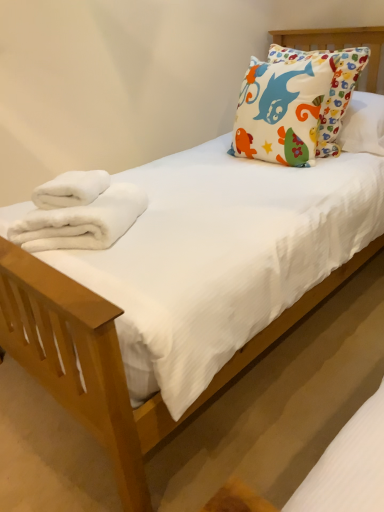
Question: Can you confirm if white fluffy towels at lower left, which appears as the second bath towel when viewed from the top, is positioned to the left of multicolored fabric pillow at upper right?

Choices:
 (A) yes
 (B) no

Answer: (A)

Question: Is white fluffy towels at lower left, which appears as the second bath towel when viewed from the top, placed right next to multicolored fabric pillow at upper right?

Choices:
 (A) yes
 (B) no

Answer: (B)

Question: From a real-world perspective, is white fluffy towels at lower left, which appears as the second bath towel when viewed from the top, on top of multicolored fabric pillow at upper right?

Choices:
 (A) no
 (B) yes

Answer: (A)

Question: Can multicolored fabric pillow at upper right be found inside white fluffy towels at lower left, the first bath towel ordered from the bottom?

Choices:
 (A) no
 (B) yes

Answer: (A)

Question: Is white fluffy towels at lower left, the first bath towel ordered from the bottom, facing towards multicolored fabric pillow at upper right?

Choices:
 (A) yes
 (B) no

Answer: (B)

Question: Does point (278, 147) appear closer or farther from the camera than point (41, 203)?

Choices:
 (A) farther
 (B) closer

Answer: (A)

Question: Based on their sizes in the image, would you say multicolored fabric pillow at upper right is bigger or smaller than white fluffy towel at left, the 1th bath towel in the top-to-bottom sequence?

Choices:
 (A) small
 (B) big

Answer: (B)

Question: Is multicolored fabric pillow at upper right taller or shorter than white fluffy towel at left, which is the second bath towel in bottom-to-top order?

Choices:
 (A) tall
 (B) short

Answer: (A)

Question: From a real-world perspective, is multicolored fabric pillow at upper right above or below white fluffy towel at left, which is the second bath towel in bottom-to-top order?

Choices:
 (A) above
 (B) below

Answer: (A)

Question: In terms of size, does multicolored fabric pillow at upper right appear bigger or smaller than white fluffy towels at lower left, the first bath towel ordered from the bottom?

Choices:
 (A) big
 (B) small

Answer: (A)

Question: From the image's perspective, relative to white fluffy towels at lower left, which appears as the second bath towel when viewed from the top, is multicolored fabric pillow at upper right above or below?

Choices:
 (A) above
 (B) below

Answer: (A)

Question: Looking at their shapes, would you say multicolored fabric pillow at upper right is wider or thinner than white fluffy towels at lower left, which appears as the second bath towel when viewed from the top?

Choices:
 (A) wide
 (B) thin

Answer: (B)

Question: Visually, is multicolored fabric pillow at upper right positioned to the left or to the right of white fluffy towels at lower left, which appears as the second bath towel when viewed from the top?

Choices:
 (A) right
 (B) left

Answer: (A)

Question: In terms of width, does white fluffy towels at lower left, the first bath towel ordered from the bottom, look wider or thinner when compared to white fluffy towel at left, the 1th bath towel in the top-to-bottom sequence?

Choices:
 (A) wide
 (B) thin

Answer: (A)

Question: From the image's perspective, is white fluffy towels at lower left, which appears as the second bath towel when viewed from the top, located above or below white fluffy towel at left, the 1th bath towel in the top-to-bottom sequence?

Choices:
 (A) below
 (B) above

Answer: (A)